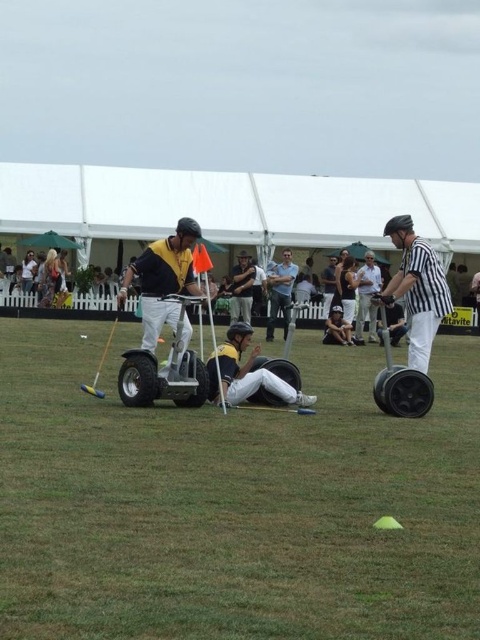
Between black striped shirt at center and white striped shirt at center, which one appears on the left side from the viewer's perspective?

black striped shirt at center is more to the left.

Does black striped shirt at center have a greater height compared to white striped shirt at center?

In fact, black striped shirt at center may be shorter than white striped shirt at center.

Is point (397, 269) positioned behind point (382, 280)?

Yes, point (397, 269) is farther from viewer.

This screenshot has width=480, height=640. Identify the location of black striped shirt at center. (417, 289).

Who is more distant from viewer, (x=432, y=276) or (x=285, y=289)?

Positioned behind is point (x=285, y=289).

Between black striped shirt at center and light blue shirt at center, which one has less height?

Standing shorter between the two is black striped shirt at center.

Who is more distant from viewer, (410, 301) or (284, 292)?

Point (284, 292)

This screenshot has height=640, width=480. I want to click on black striped shirt at center, so click(x=417, y=289).

Which is behind, point (233, 330) or point (361, 268)?

The point (361, 268) is more distant.

Between yellow helmet at center and white striped shirt at center, which one appears on the right side from the viewer's perspective?

white striped shirt at center

I want to click on yellow helmet at center, so click(247, 372).